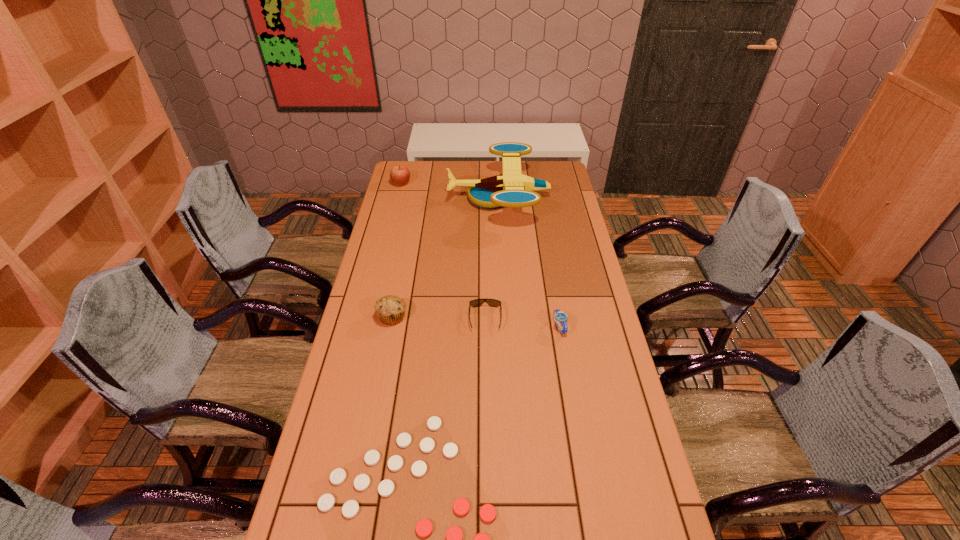
At what (x,y) coordinates should I click in order to perform the action: click on free spot located on the front of the watch. Please return your answer as a coordinate pair (x, y). This screenshot has height=540, width=960. Looking at the image, I should click on (572, 403).

Locate an element on the screen. free space located 0.360m on the front-facing side of the second shortest object is located at coordinates (487, 434).

Image resolution: width=960 pixels, height=540 pixels. Identify the location of drone positioned at the far edge. (512, 189).

You are a GUI agent. You are given a task and a screenshot of the screen. Output one action in this format:
    pyautogui.click(x=<x>, y=<y>)
    Task: Click on the apple that is at the far edge
    The height and width of the screenshot is (540, 960).
    Given the screenshot: What is the action you would take?
    pyautogui.click(x=400, y=175)

Image resolution: width=960 pixels, height=540 pixels. In order to click on apple that is positioned at the left edge in this screenshot , I will do (x=400, y=175).

The image size is (960, 540). Find the location of `muffin at the left edge`. muffin at the left edge is located at coordinates (390, 309).

Where is `drone located in the right edge section of the desktop`? The height and width of the screenshot is (540, 960). drone located in the right edge section of the desktop is located at coordinates (x=512, y=189).

Locate an element on the screen. This screenshot has height=540, width=960. watch positioned at the right edge is located at coordinates (559, 317).

The width and height of the screenshot is (960, 540). I want to click on object that is positioned at the far left corner, so click(400, 175).

Identify the location of object at the far right corner. This screenshot has width=960, height=540. (512, 189).